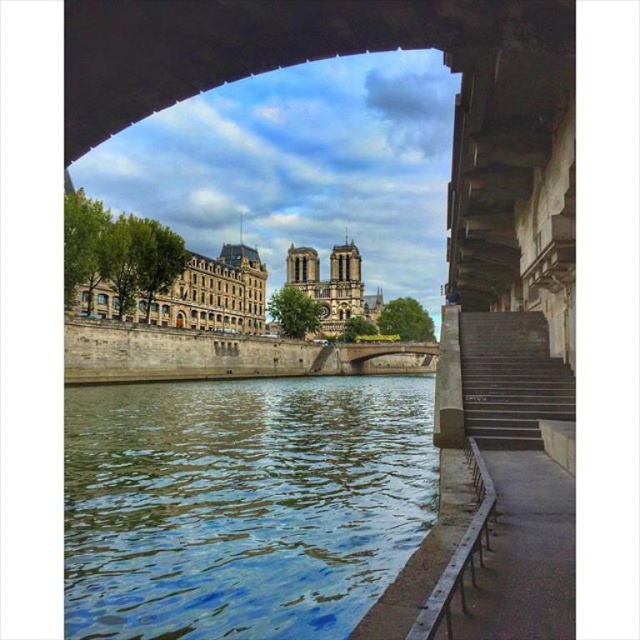
You are standing under the stone bridge and looking out towards the river. There are two points marked on the bridge arch in front of you. The first point is at coordinates point [280,564] and the second is at point [433,620]. Which point is closer to your eyes?

Point [280,564] is further to the camera than point [433,620]. Therefore, the point closer to your eyes is point [433,620].

Looking at this image, you are standing under the stone bridge arch and want to walk towards the cityscape in the distance. There are two points marked on the ground ahead of you. The first point is at location point (508, 324) and the second is at point (449, 609). Which point is closer to the cityscape you are facing?

Point (449, 609) is closer to the cityscape because it is in front of point (508, 324), which is behind it.

You are standing under the stone bridge arch and looking out towards the historic cityscape. You notice a specific point marked at coordinates (241, 504). What object is located at that point?

The blue water at lower left is located at point (241, 504).